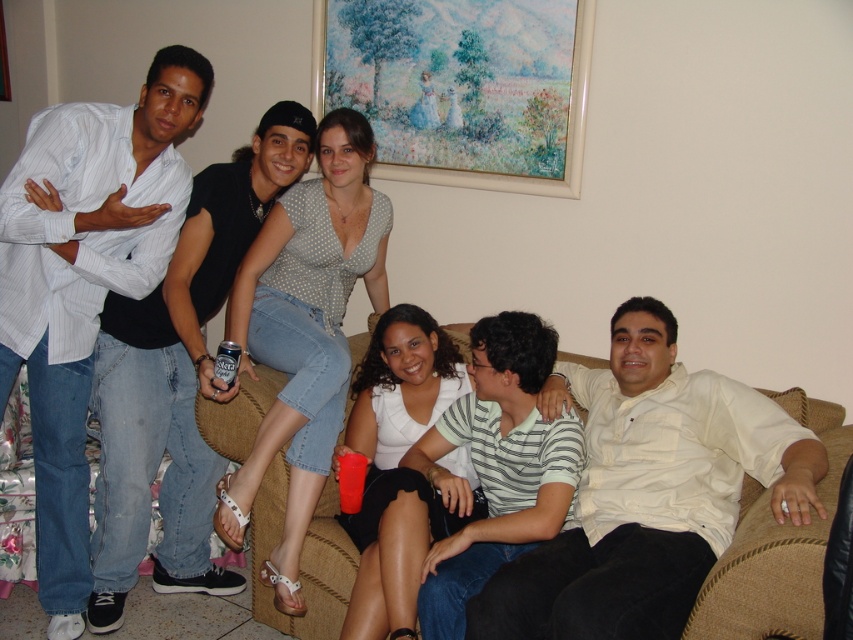
Based on the photo, can you confirm if white striped shirt at left is shorter than white matte dress at center?

No, white striped shirt at left is not shorter than white matte dress at center.

Is white striped shirt at left positioned at the back of white matte dress at center?

No, white striped shirt at left is in front of white matte dress at center.

Which is behind, point (44, 154) or point (376, 348)?

Positioned behind is point (376, 348).

At what (x,y) coordinates should I click in order to perform the action: click on white striped shirt at left. Please return your answer as a coordinate pair (x, y). This screenshot has width=853, height=640. Looking at the image, I should click on (84, 282).

Between pastel oil painting at upper center and polka dot blouse at upper center, which one has more height?

polka dot blouse at upper center is taller.

Between point (553, 64) and point (244, 358), which one is positioned in front?

Positioned in front is point (244, 358).

Which is behind, point (566, 186) or point (248, 266)?

Point (566, 186)

The width and height of the screenshot is (853, 640). I want to click on pastel oil painting at upper center, so click(x=461, y=86).

Does point (61, 602) come behind point (247, 333)?

No.

You are a GUI agent. You are given a task and a screenshot of the screen. Output one action in this format:
    pyautogui.click(x=<x>, y=<y>)
    Task: Click on the white striped shirt at left
    This screenshot has width=853, height=640.
    Given the screenshot: What is the action you would take?
    pyautogui.click(x=84, y=282)